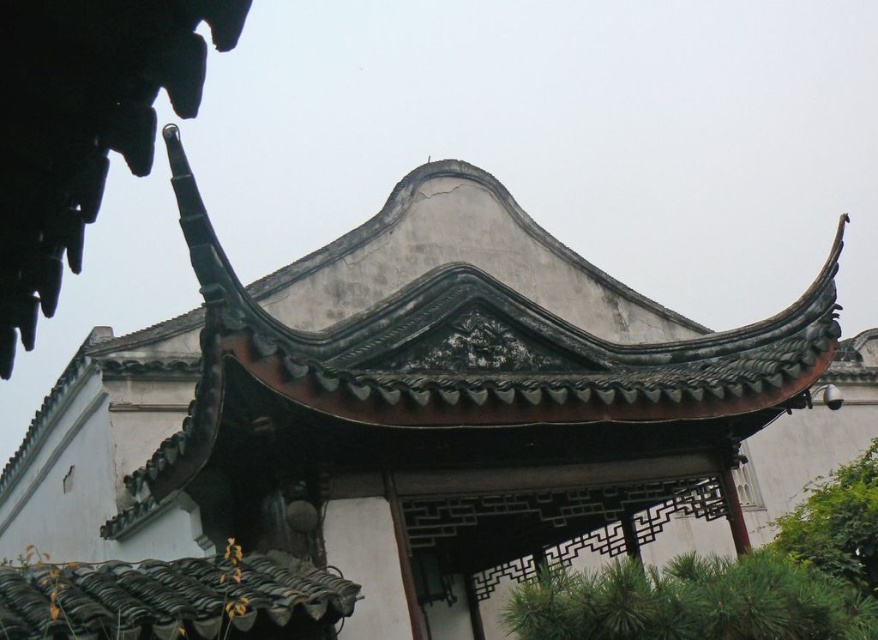
Question: Among these objects, which one is nearest to the camera?

Choices:
 (A) green leafy tree at lower right
 (B) green needle-like leaves at lower right

Answer: (B)

Question: Considering the relative positions of green needle-like leaves at lower right and green leafy tree at lower right in the image provided, where is green needle-like leaves at lower right located with respect to green leafy tree at lower right?

Choices:
 (A) right
 (B) left

Answer: (B)

Question: Can you confirm if green needle-like leaves at lower right is wider than green leafy tree at lower right?

Choices:
 (A) no
 (B) yes

Answer: (A)

Question: Which point is closer to the camera?

Choices:
 (A) green leafy tree at lower right
 (B) green needle-like leaves at lower right

Answer: (B)

Question: Is green needle-like leaves at lower right positioned at the back of green leafy tree at lower right?

Choices:
 (A) yes
 (B) no

Answer: (B)